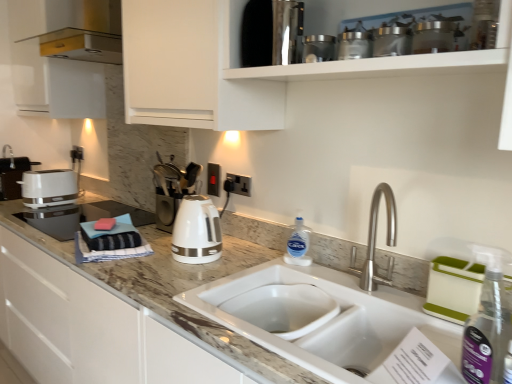
Question: Is metallic silver canisters at upper center, marked as the 2th appliance in a right-to-left arrangement, wider than white glossy toaster at left?

Choices:
 (A) no
 (B) yes

Answer: (A)

Question: Can you confirm if metallic silver canisters at upper center, marked as the 2th appliance in a right-to-left arrangement, is smaller than white glossy toaster at left?

Choices:
 (A) yes
 (B) no

Answer: (A)

Question: From a real-world perspective, is metallic silver canisters at upper center, marked as the 2th appliance in a right-to-left arrangement, located beneath white glossy toaster at left?

Choices:
 (A) yes
 (B) no

Answer: (B)

Question: Would you consider metallic silver canisters at upper center, which is counted as the 4th appliance, starting from the left, to be distant from white glossy toaster at left?

Choices:
 (A) no
 (B) yes

Answer: (B)

Question: From the image's perspective, is metallic silver canisters at upper center, the 2th appliance positioned from the front, on white glossy toaster at left?

Choices:
 (A) yes
 (B) no

Answer: (A)

Question: Does point (309, 61) appear closer or farther from the camera than point (392, 51)?

Choices:
 (A) closer
 (B) farther

Answer: (B)

Question: Would you say metallic stainless steel container at upper center, the 3th appliance from the back, is to the left or to the right of metallic silver canisters at upper center, which is counted as the 4th appliance, starting from the left, in the picture?

Choices:
 (A) right
 (B) left

Answer: (B)

Question: In the image, is metallic stainless steel container at upper center, the third appliance from the front, positioned in front of or behind metallic silver canisters at upper center, which is counted as the 4th appliance, starting from the left?

Choices:
 (A) behind
 (B) front

Answer: (A)

Question: Is metallic stainless steel container at upper center, the 3th appliance from the back, bigger or smaller than metallic silver canisters at upper center, which is the fourth appliance from back to front?

Choices:
 (A) big
 (B) small

Answer: (B)

Question: Considering the positions of white ceramic sink at center and clear plastic bottle at sink, marked as the second bottle in a front-to-back arrangement, in the image, is white ceramic sink at center wider or thinner than clear plastic bottle at sink, marked as the second bottle in a front-to-back arrangement,?

Choices:
 (A) wide
 (B) thin

Answer: (A)

Question: Would you say white ceramic sink at center is inside or outside clear plastic bottle at sink, which is counted as the 2th bottle, starting from the right?

Choices:
 (A) outside
 (B) inside

Answer: (A)

Question: From a real-world perspective, is white ceramic sink at center physically located above or below clear plastic bottle at sink, arranged as the first bottle when viewed from the left?

Choices:
 (A) above
 (B) below

Answer: (B)

Question: In the image, is white ceramic sink at center on the left side or the right side of clear plastic bottle at sink, which is counted as the 2th bottle, starting from the right?

Choices:
 (A) left
 (B) right

Answer: (B)

Question: From their relative heights in the image, would you say clear plastic spray bottle at right, acting as the first bottle starting from the right, is taller or shorter than white ceramic sink at center?

Choices:
 (A) short
 (B) tall

Answer: (B)

Question: From the image's perspective, relative to white ceramic sink at center, is clear plastic spray bottle at right, the 2th bottle when ordered from left to right, above or below?

Choices:
 (A) above
 (B) below

Answer: (A)